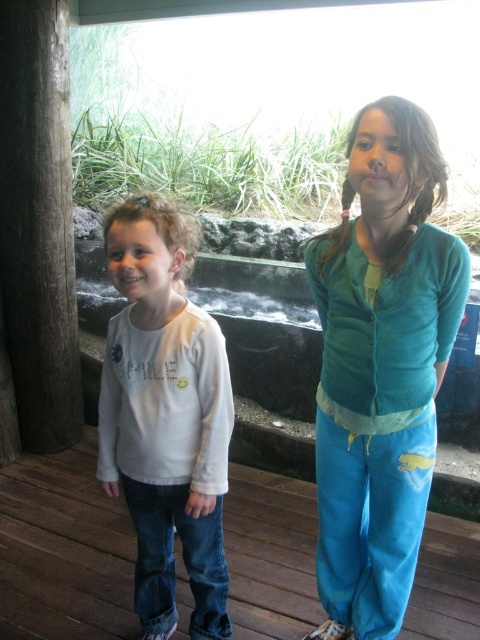
Which is above, teal cardigan at center or wooden deck at center?

teal cardigan at center is higher up.

The image size is (480, 640). Describe the element at coordinates (381, 365) in the screenshot. I see `teal cardigan at center` at that location.

Identify the location of teal cardigan at center. Image resolution: width=480 pixels, height=640 pixels. (381, 365).

How distant is wooden deck at center from white cotton shirt at left?

wooden deck at center and white cotton shirt at left are 27.99 inches apart from each other.

Between point (239, 627) and point (216, 518), which one is positioned behind?

The point (239, 627) is more distant.

The height and width of the screenshot is (640, 480). What are the coordinates of `wooden deck at center` in the screenshot? It's located at (63, 550).

Does teal cardigan at center appear under white cotton shirt at left?

No.

Find the location of a particular element. The image size is (480, 640). teal cardigan at center is located at coordinates (381, 365).